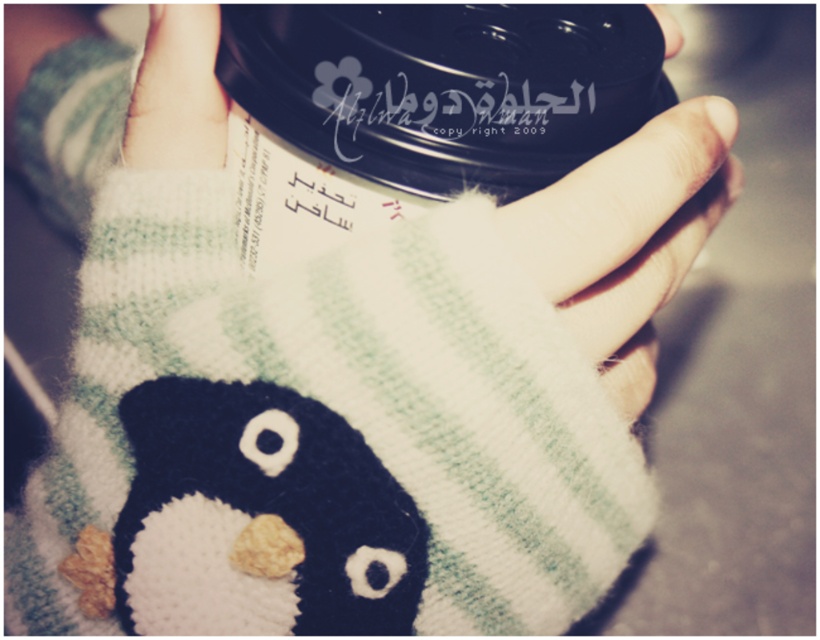
Based on the coordinates provided, where is the white knitted penguin at lower left located in the image?

The white knitted penguin at lower left is located at the 2D coordinates point (258, 516).

You are trying to touch the cup in the image. If you move your finger from point point (167,120) to point (340,518), will your finger pass in front of the cup?

Point (340,518) is in front of point (167,120), so moving your finger from point (167,120) to point (340,518) would mean your finger is moving towards the cup. Therefore, your finger would pass in front of the cup.